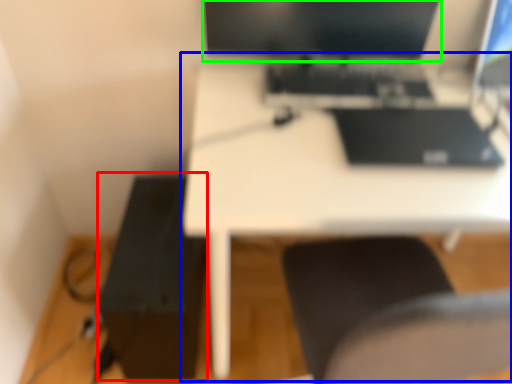
Question: Which object is positioned farthest from printer (highlighted by a red box)? Select from table (highlighted by a blue box) and computer monitor (highlighted by a green box).

Choices:
 (A) table
 (B) computer monitor

Answer: (B)